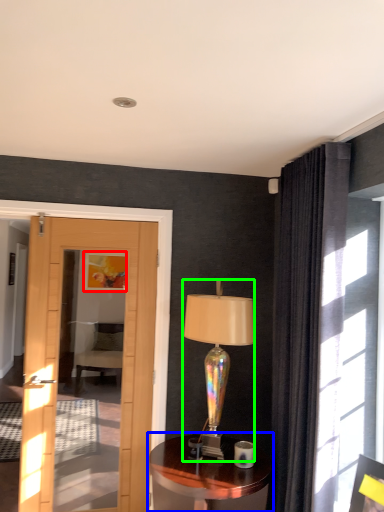
Question: Which is nearer to the picture frame (highlighted by a red box)? table (highlighted by a blue box) or lamp (highlighted by a green box).

Choices:
 (A) table
 (B) lamp

Answer: (B)